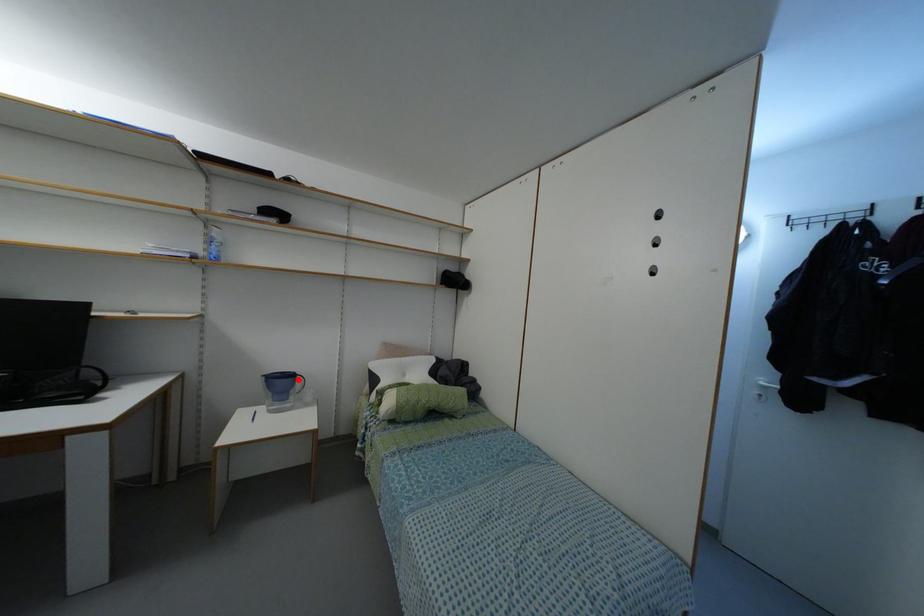
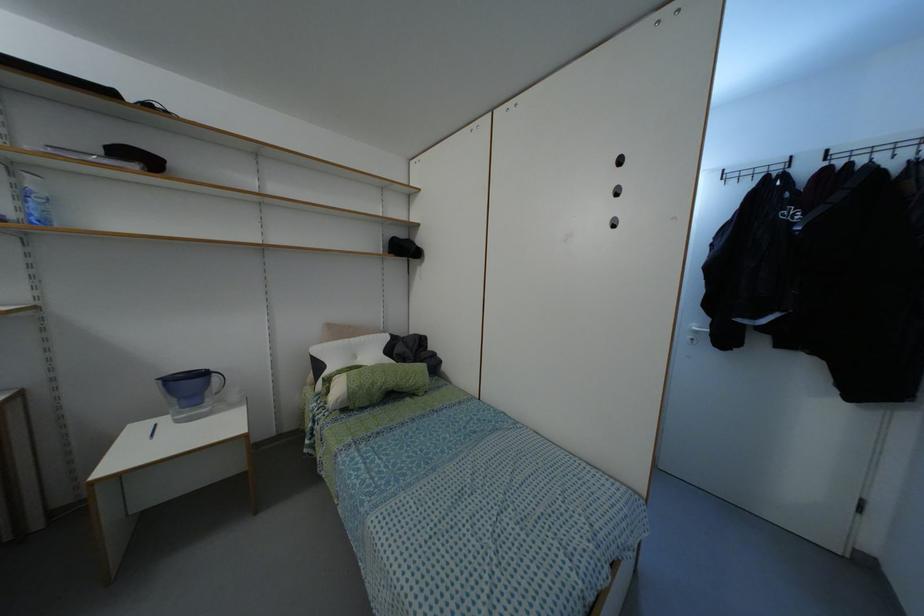
Question: I am providing you with two images of the same scene from different viewpoints. Given a red point in image1, look at the same physical point in image2. Is it:

Choices:
 (A) Closer to the viewpoint
 (B) Farther from the viewpoint

Answer: (B)